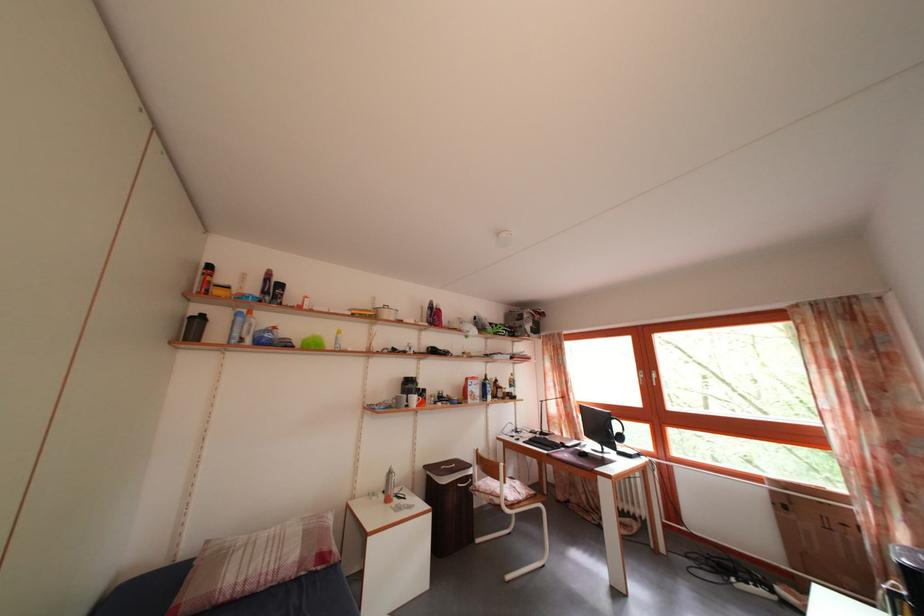
Identify the location of chair sitting surface. (515, 493).